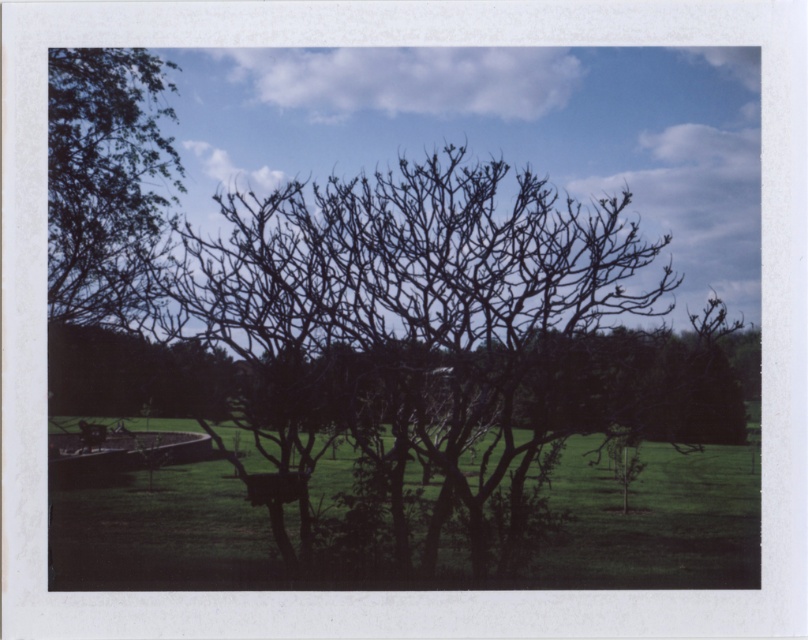
You are standing in the middle of the field and see the bare branches at center and the green grass at lower left. Which object is positioned to the right of the other?

The bare branches at center are positioned to the right of the green grass at lower left.

You are an artist planning to paint this scene. The bare branches at center and the green leafy tree at upper left are both important elements. Which of these two objects will you need to paint in a larger scale to maintain their visual prominence in your artwork?

The bare branches at center has a larger size compared to green leafy tree at upper left, so you should paint the bare branches at center in a larger scale to maintain their visual prominence.